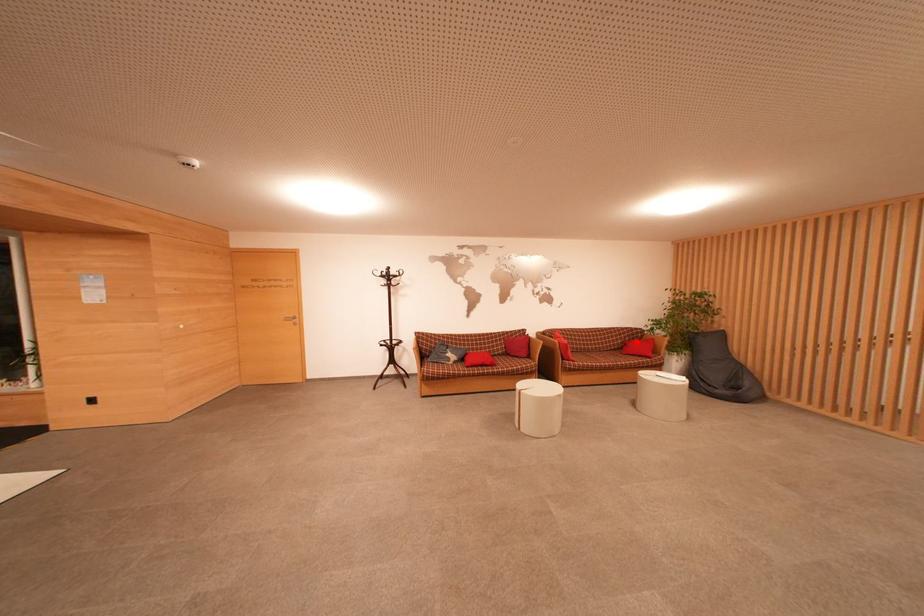
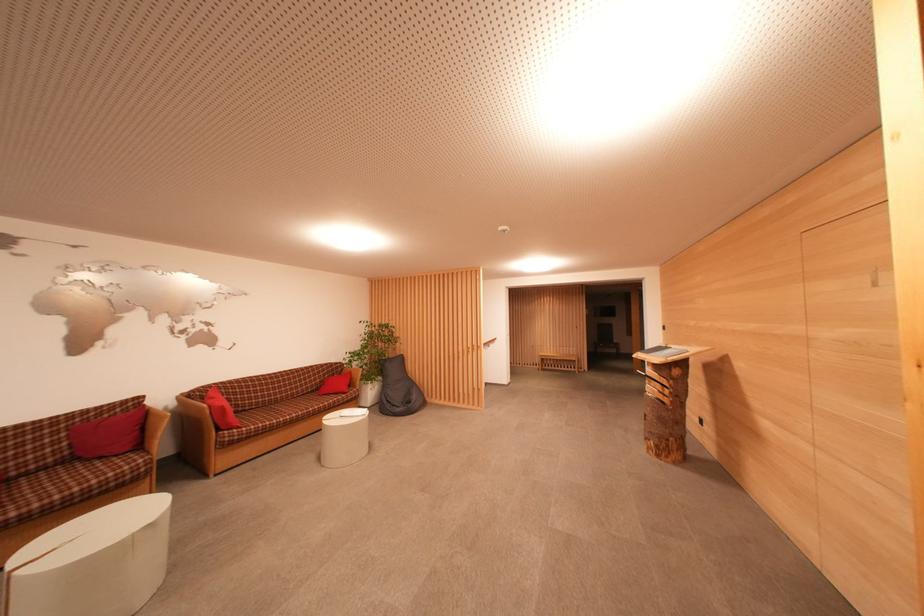
In the second image, find the point that corresponds to the highlighted location in the first image.

(337, 378)